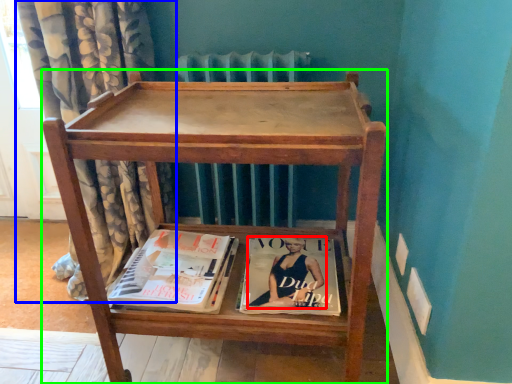
Question: Considering the real-world distances, which object is closest to person (highlighted by a red box)? curtain (highlighted by a blue box) or furniture (highlighted by a green box).

Choices:
 (A) curtain
 (B) furniture

Answer: (B)